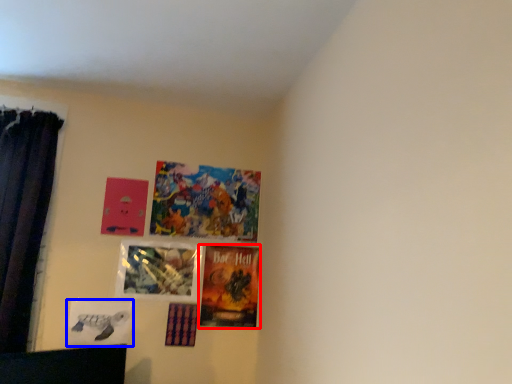
Question: Which object is further to the camera taking this photo, picture frame (highlighted by a red box) or picture frame (highlighted by a blue box)?

Choices:
 (A) picture frame
 (B) picture frame

Answer: (A)